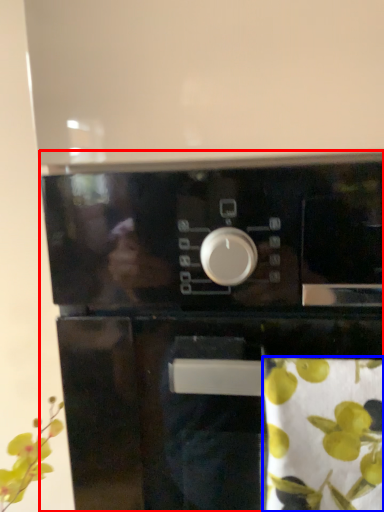
Question: Which of the following is the closest to the observer, home appliance (highlighted by a red box) or flower (highlighted by a blue box)?

Choices:
 (A) home appliance
 (B) flower

Answer: (B)